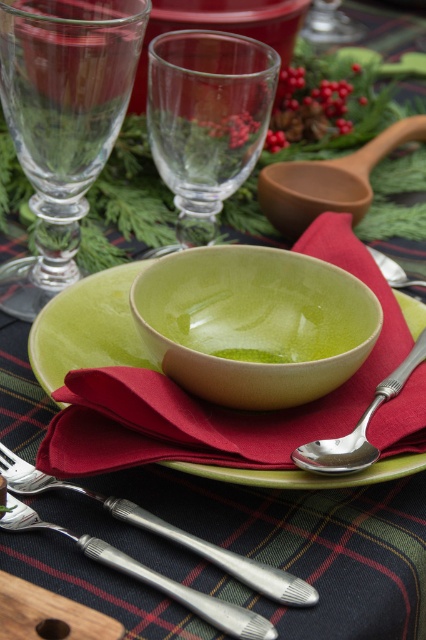
Question: Can you confirm if transparent glass wine glass at upper center is bigger than silver polished fork at lower left?

Choices:
 (A) yes
 (B) no

Answer: (A)

Question: Which of the following is the closest to the observer?

Choices:
 (A) green matte plate at center
 (B) silver polished fork at lower left
 (C) silver metallic spoon at lower right
 (D) transparent glass wine glass at upper center

Answer: (B)

Question: Which point is closer to the camera taking this photo?

Choices:
 (A) (140, 44)
 (B) (37, 364)
 (C) (284, 579)

Answer: (C)

Question: Considering the relative positions of transparent glass wine glass at upper left and green matte plate at center in the image provided, where is transparent glass wine glass at upper left located with respect to green matte plate at center?

Choices:
 (A) above
 (B) below

Answer: (A)

Question: Which point is farther from the camera taking this photo?

Choices:
 (A) (207, 58)
 (B) (259, 582)
 (C) (302, 464)

Answer: (A)

Question: Is transparent glass wine glass at upper center to the right of silver metallic spoon at lower right from the viewer's perspective?

Choices:
 (A) yes
 (B) no

Answer: (B)